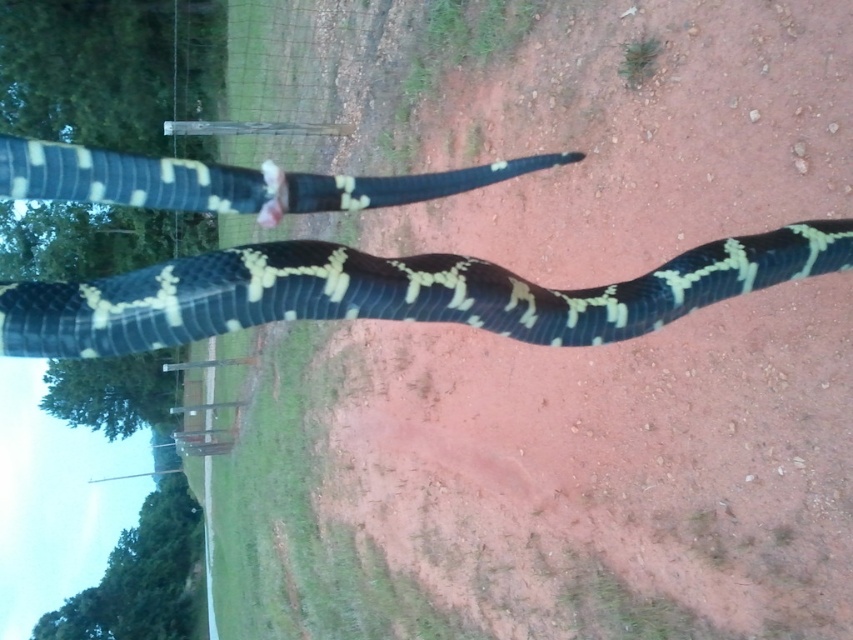
Does black/yellow scales snake at center have a smaller size compared to black/yellow scales at upper center?

Incorrect, black/yellow scales snake at center is not smaller in size than black/yellow scales at upper center.

Who is more distant from viewer, (384, 186) or (294, 176)?

Positioned behind is point (384, 186).

Which is behind, point (96, 280) or point (241, 172)?

Point (241, 172)

Image resolution: width=853 pixels, height=640 pixels. In order to click on black/yellow scales snake at center in this screenshot , I will do `click(393, 292)`.